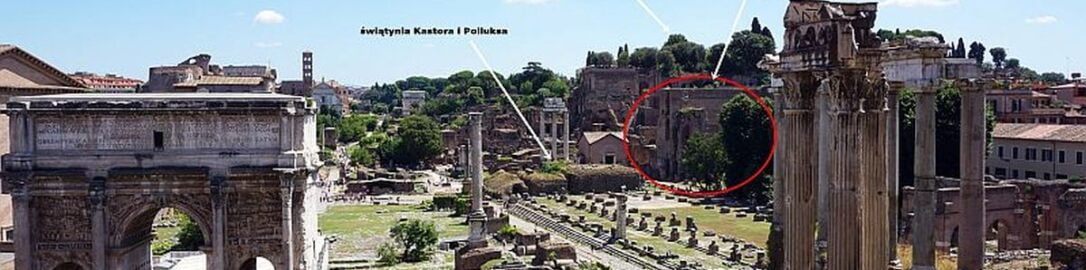
This screenshot has width=1086, height=270. I want to click on rod, so click(206, 157).